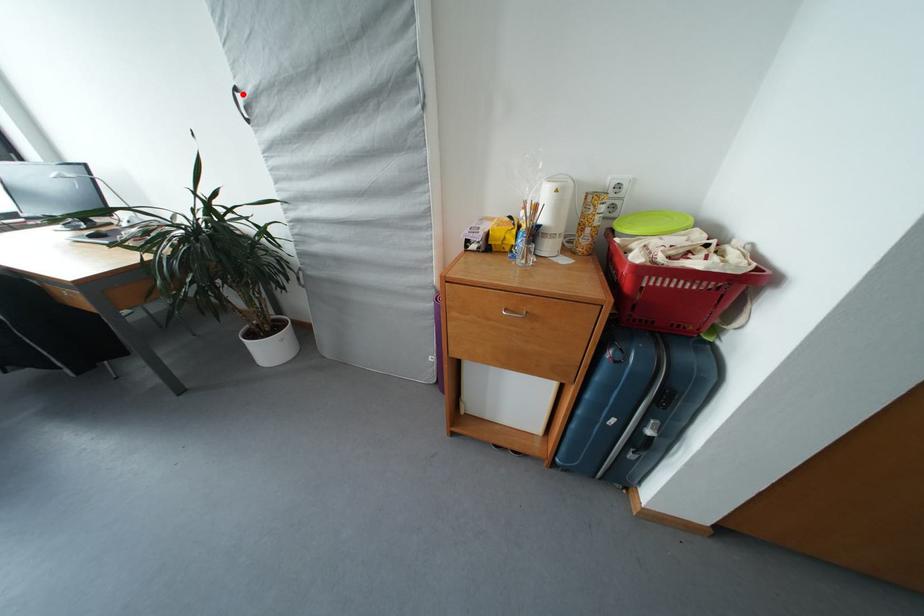
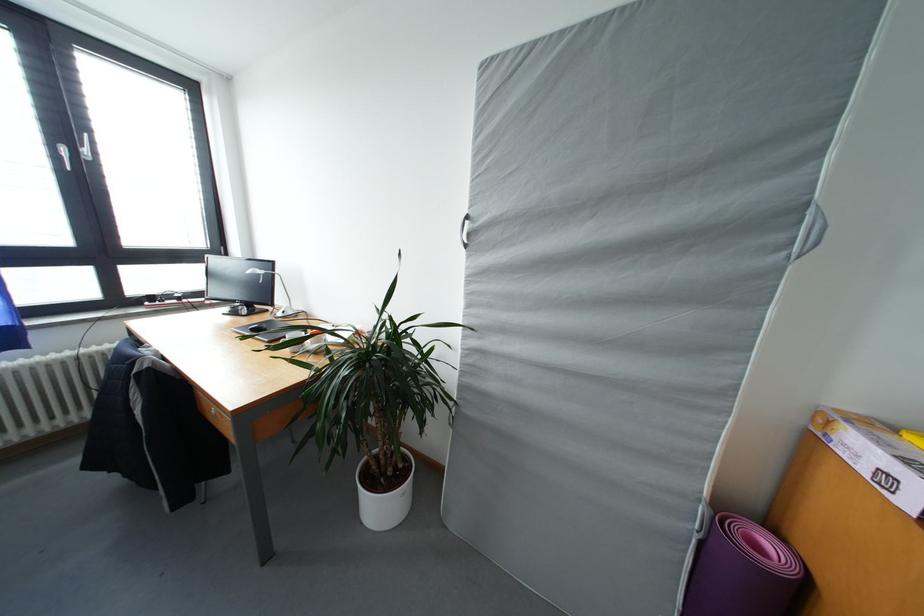
Locate, in the second image, the point that corresponds to the highlighted location in the first image.

(473, 222)